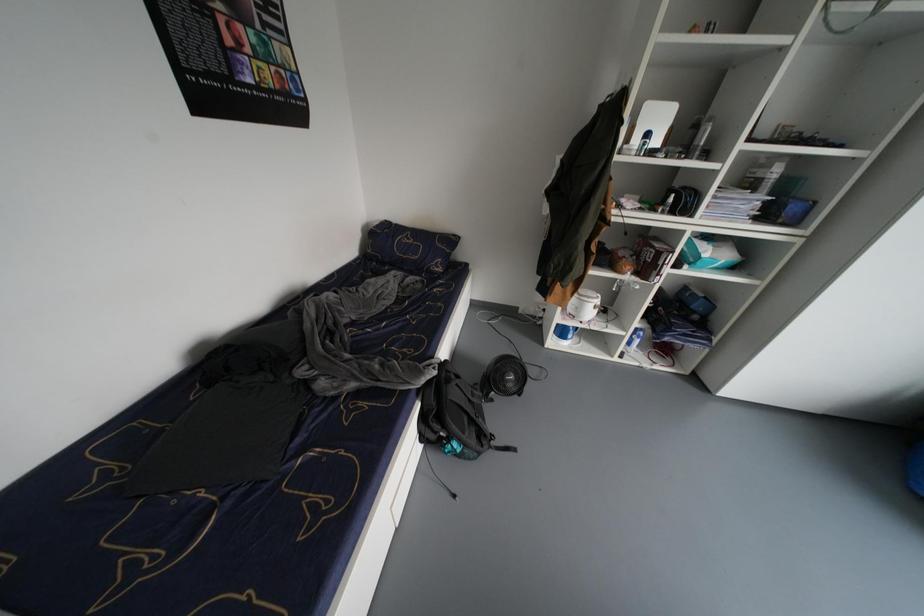
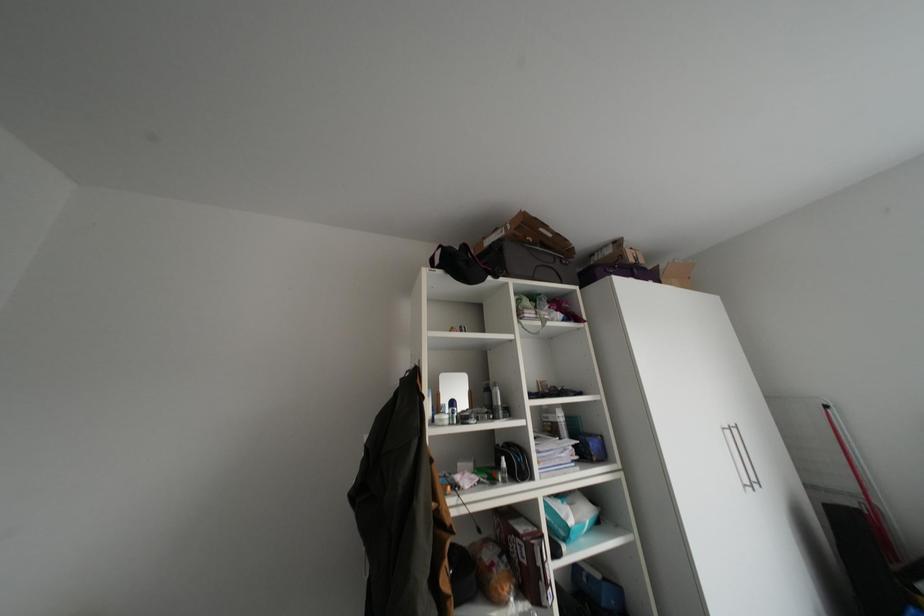
Based on the continuous images, in which direction is the camera rotating?

The rotation direction of the camera is right-up.